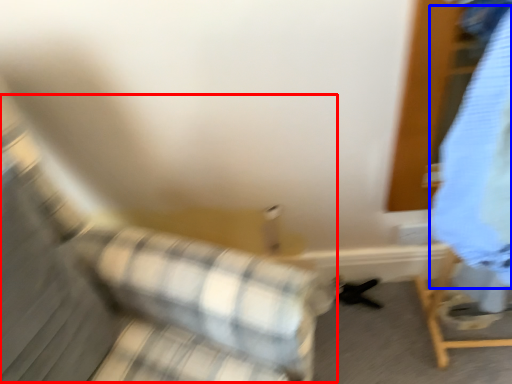
Question: Which of the following is the farthest to the observer, couch (highlighted by a red box) or clothing (highlighted by a blue box)?

Choices:
 (A) couch
 (B) clothing

Answer: (B)